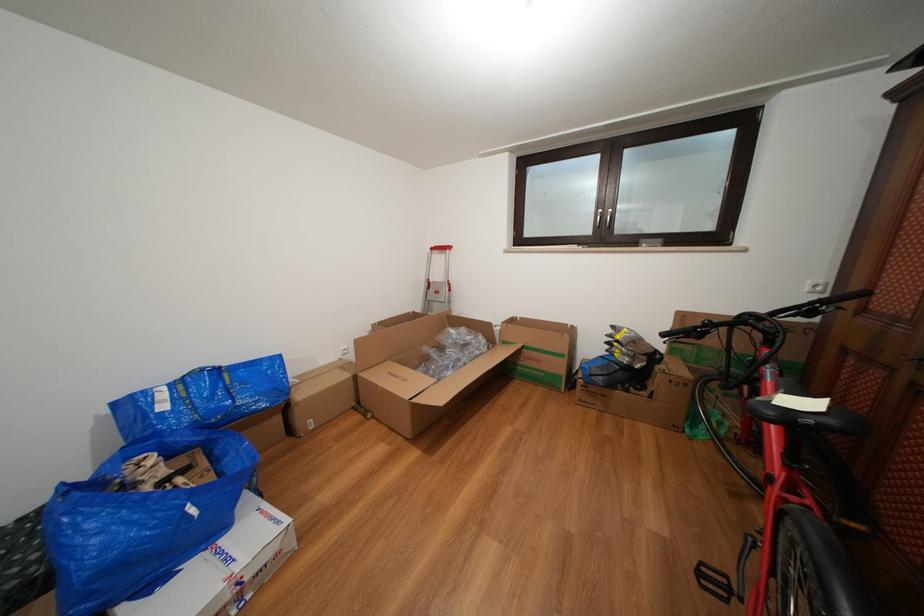
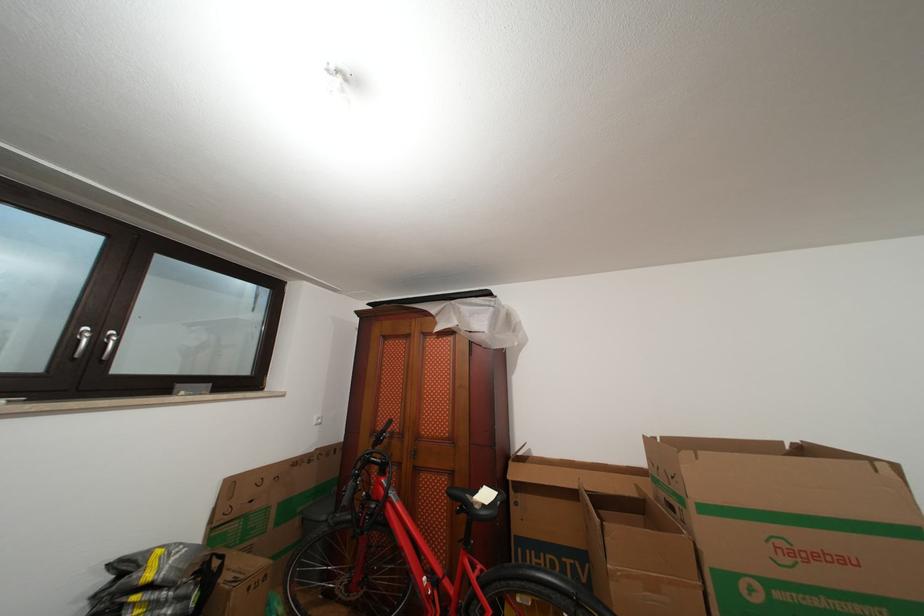
Question: The camera is either moving clockwise (left) or counter-clockwise (right) around the object. The first image is from the beginning of the video and the second image is from the end. Is the camera moving left or right when shooting the video?

Choices:
 (A) Left
 (B) Right

Answer: (A)